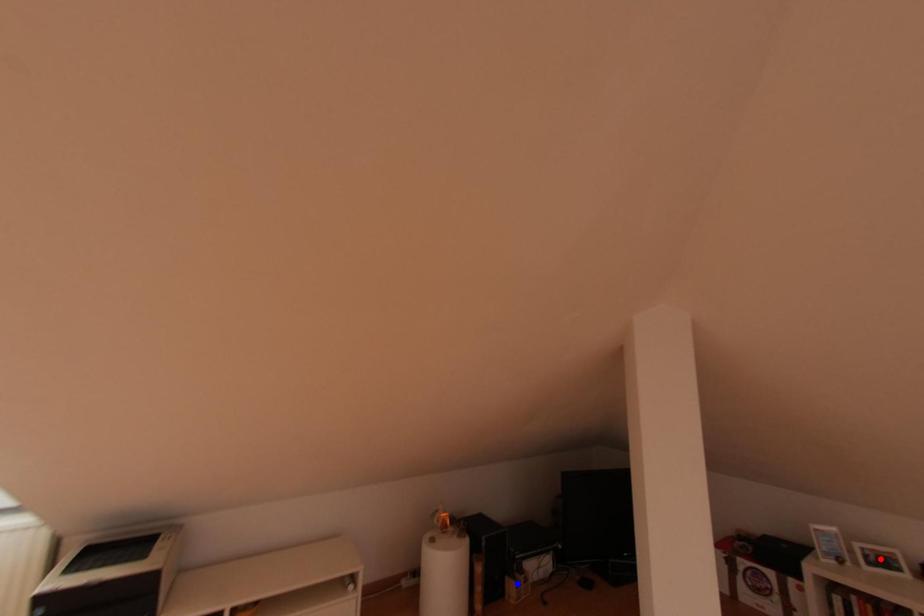
Question: Two points are marked on the image. Which point is closer to the camera?

Choices:
 (A) Blue point is closer.
 (B) Red point is closer.

Answer: (B)